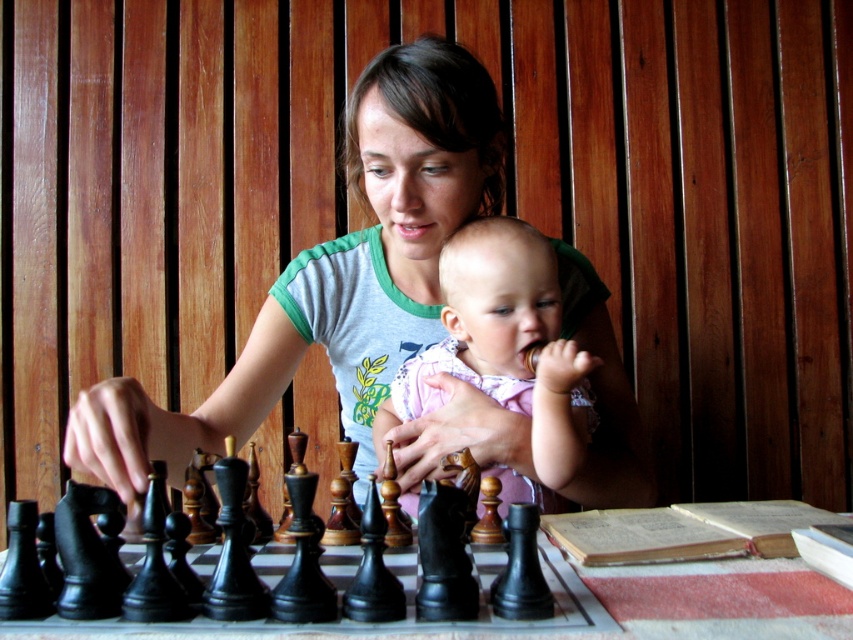
Is matte gray t-shirt at center closer to camera compared to matte pink dress at center?

Yes.

What do you see at coordinates (334, 275) in the screenshot?
I see `matte gray t-shirt at center` at bounding box center [334, 275].

This screenshot has height=640, width=853. Find the location of `matte gray t-shirt at center`. matte gray t-shirt at center is located at coordinates (334, 275).